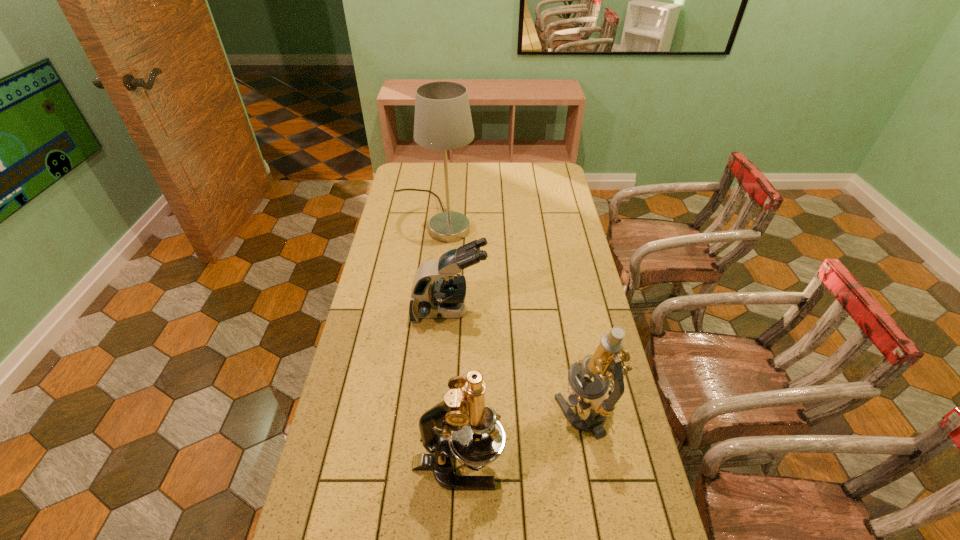
Find the location of a particular element. The width and height of the screenshot is (960, 540). object that is the third nearest to the rightmost object is located at coordinates (442, 121).

I want to click on microscope identified as the third closest to the tallest object, so click(470, 431).

Find the location of a particular element. Image resolution: width=960 pixels, height=540 pixels. microscope that is the closest to the shortest object is located at coordinates (605, 365).

Identify the location of free space that satisfies the following two spatial constraints: 1. on the back side of the rightmost microscope; 2. through the eyepieces of the farthest microscope. (564, 311).

Identify the location of free space that satisfies the following two spatial constraints: 1. through the eyepieces of the shortest object; 2. on the right side of the rightmost object. This screenshot has height=540, width=960. (442, 412).